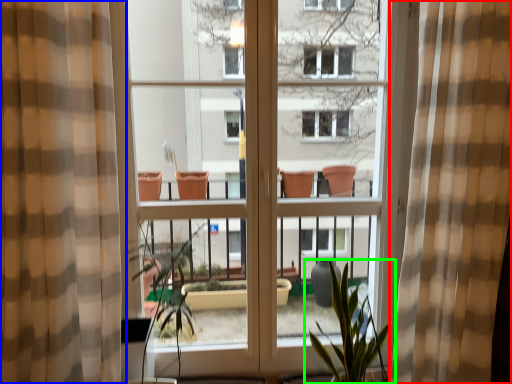
Question: Which object is positioned closest to curtain (highlighted by a red box)? Select from curtain (highlighted by a blue box) and houseplant (highlighted by a green box).

Choices:
 (A) curtain
 (B) houseplant

Answer: (B)